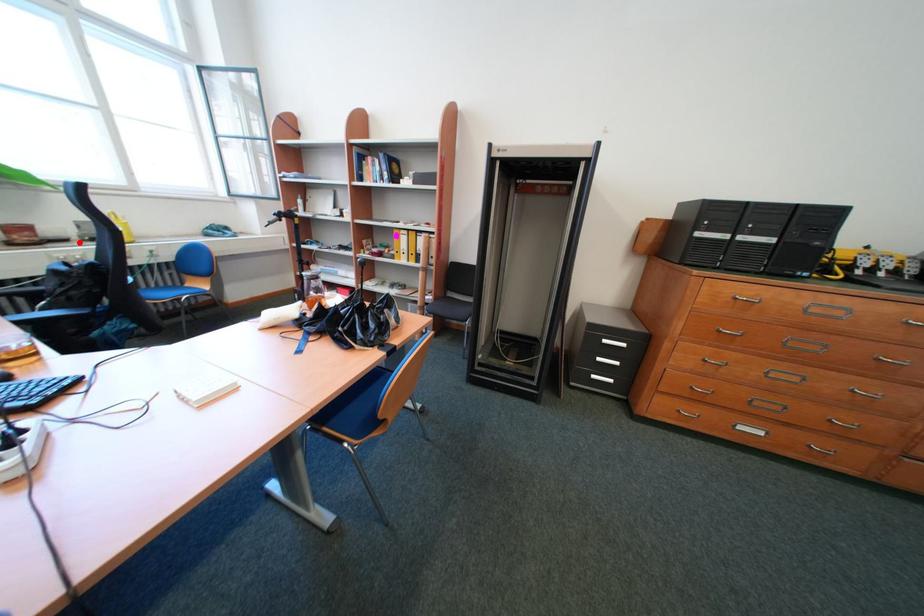
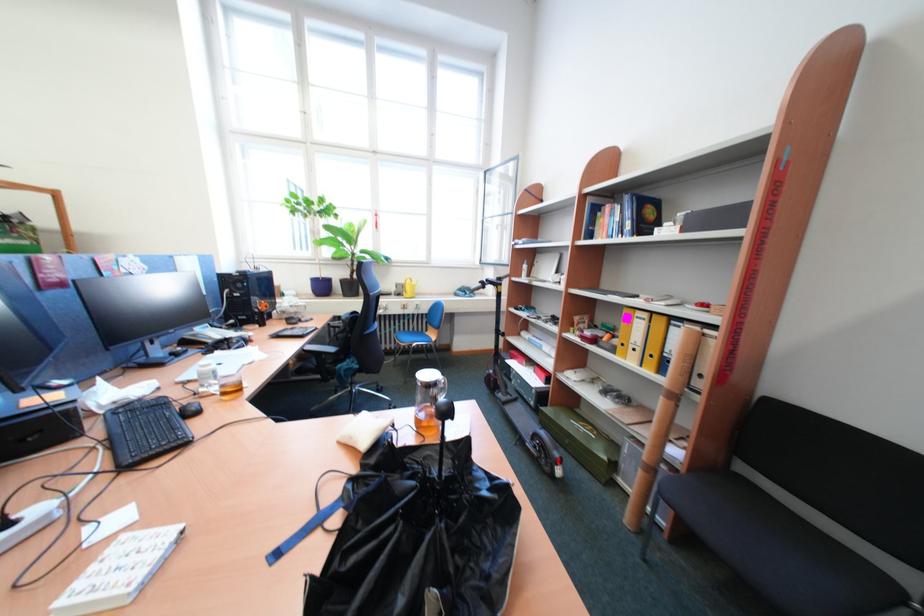
Question: I am providing you with two images of the same scene from different viewpoints. In image1, a red point is highlighted. Considering the same 3D point in image2, which of the following is correct?

Choices:
 (A) It is closer
 (B) It is farther

Answer: (A)